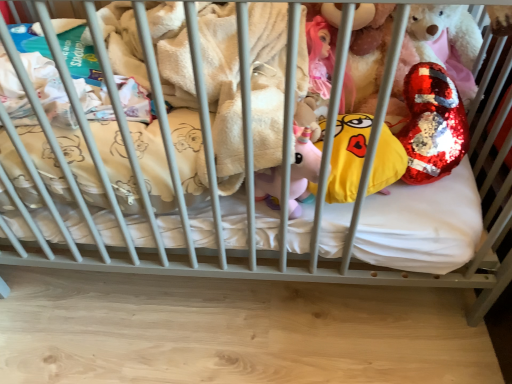
Question: Would you say white soft mattress at center is outside shiny sequined heart at upper right?

Choices:
 (A) yes
 (B) no

Answer: (A)

Question: From the image's perspective, is white soft mattress at center below shiny sequined heart at upper right?

Choices:
 (A) no
 (B) yes

Answer: (B)

Question: Is white soft mattress at center in contact with shiny sequined heart at upper right?

Choices:
 (A) yes
 (B) no

Answer: (B)

Question: Does white soft mattress at center have a lesser width compared to shiny sequined heart at upper right?

Choices:
 (A) no
 (B) yes

Answer: (A)

Question: From a real-world perspective, does white soft mattress at center stand above shiny sequined heart at upper right?

Choices:
 (A) no
 (B) yes

Answer: (A)

Question: Can you confirm if white soft mattress at center is smaller than shiny sequined heart at upper right?

Choices:
 (A) yes
 (B) no

Answer: (B)

Question: Is white soft mattress at center thinner than yellow sequined pillow at center?

Choices:
 (A) no
 (B) yes

Answer: (A)

Question: Does white soft mattress at center have a smaller size compared to yellow sequined pillow at center?

Choices:
 (A) no
 (B) yes

Answer: (A)

Question: Is there a large distance between white soft mattress at center and yellow sequined pillow at center?

Choices:
 (A) yes
 (B) no

Answer: (B)

Question: Does white soft mattress at center turn towards yellow sequined pillow at center?

Choices:
 (A) no
 (B) yes

Answer: (A)

Question: Considering the relative sizes of white soft mattress at center and yellow sequined pillow at center in the image provided, is white soft mattress at center bigger than yellow sequined pillow at center?

Choices:
 (A) yes
 (B) no

Answer: (A)

Question: From the image's perspective, is white soft mattress at center under yellow sequined pillow at center?

Choices:
 (A) no
 (B) yes

Answer: (A)

Question: From the image's perspective, is shiny sequined heart at upper right under yellow sequined pillow at center?

Choices:
 (A) yes
 (B) no

Answer: (B)